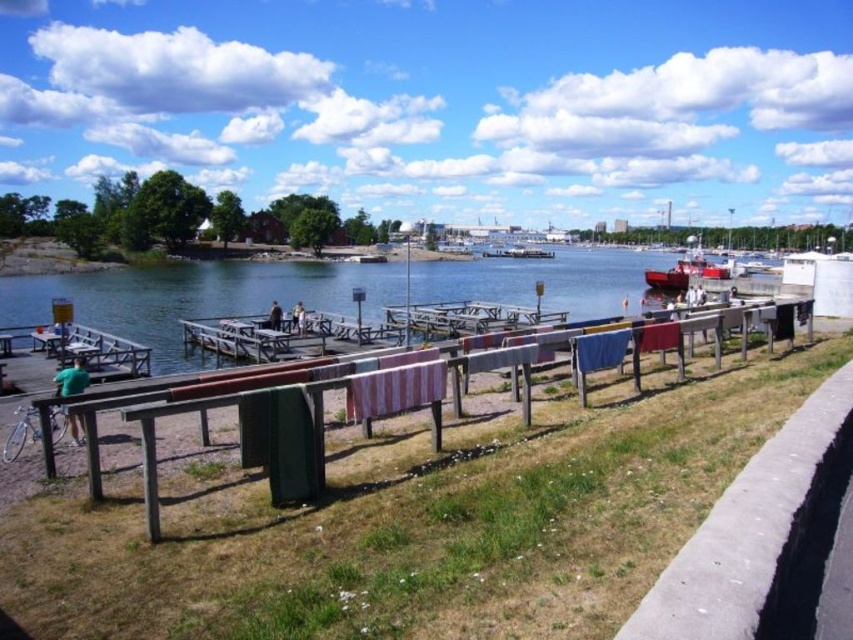
Question: Estimate the real-world distances between objects in this image. Which object is closer to the wooden picnic table at center?

Choices:
 (A) red matte boat at center
 (B) clear water at center
 (C) white matte boat at center

Answer: (B)

Question: Can you confirm if red matte boat at center is smaller than wooden picnic table at center?

Choices:
 (A) yes
 (B) no

Answer: (B)

Question: Does green grass at lower center have a larger size compared to red matte boat at center?

Choices:
 (A) yes
 (B) no

Answer: (B)

Question: Estimate the real-world distances between objects in this image. Which object is closer to the red matte boat at center?

Choices:
 (A) green grass at lower center
 (B) wooden picnic table at center
 (C) white matte boat at center

Answer: (C)

Question: Is clear water at center below wooden picnic table at center?

Choices:
 (A) yes
 (B) no

Answer: (B)

Question: Which of the following is the farthest from the observer?

Choices:
 (A) red matte boat at center
 (B) green grass at lower center

Answer: (A)